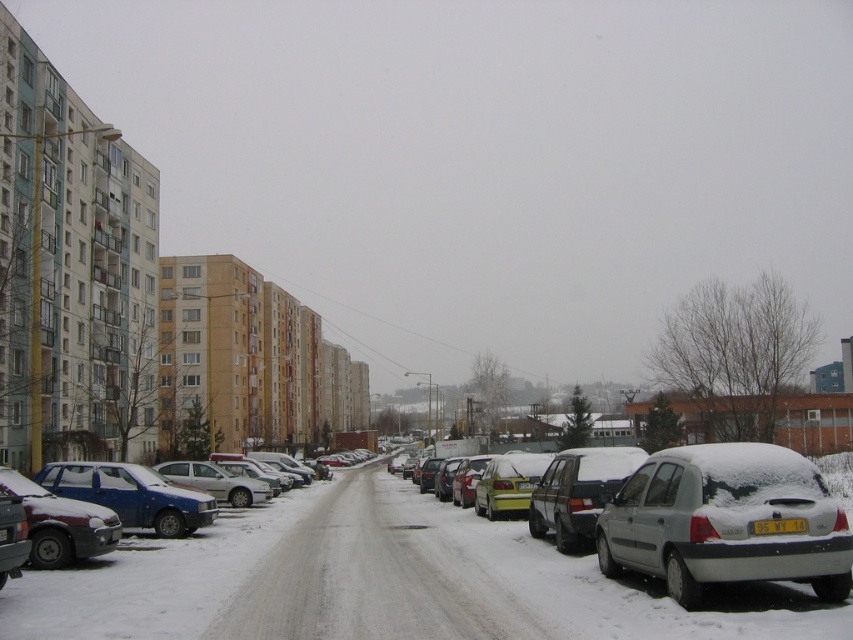
You are a delivery driver who needs to park your vehicle in this street. You have a delivery van that is 2 meters wide. You see the white matte car at lower right and the blue matte sedan at lower left parked on the street. Can your van fit between them if you position it directly in the middle?

The white matte car at lower right has a lesser width compared to the blue matte sedan at lower left. However, without knowing the exact distance between them or the total available space, it is impossible to determine if the 2 meter wide van can fit. The question does not provide enough information about the spacing between the two vehicles.

You are standing on a snowy street and want to walk from the point at coordinates (595, 513) to the point at coordinates (57, 509). Which direction should you face to walk towards the second point?

You should face downward because point (595, 513) is closer to the viewer than point (57, 509), so the second point is located below the first one in the image.